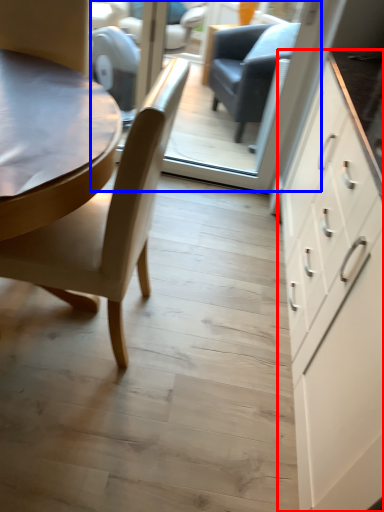
Question: Which of the following is the closest to the observer, cabinetry (highlighted by a red box) or glass door (highlighted by a blue box)?

Choices:
 (A) cabinetry
 (B) glass door

Answer: (A)